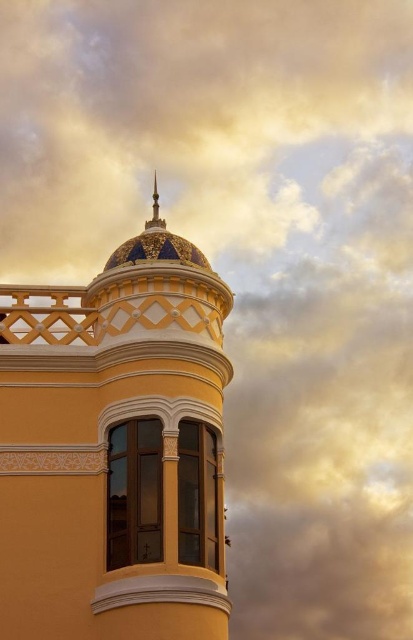
Is point (118, 620) in front of point (165, 227)?

That is True.

Between matte yellow bell tower at center and gold metallic spire at upper center, which one is positioned higher?

gold metallic spire at upper center

Which is in front, point (185, 556) or point (156, 186)?

Positioned in front is point (185, 556).

You are a GUI agent. You are given a task and a screenshot of the screen. Output one action in this format:
    pyautogui.click(x=<x>, y=<y>)
    Task: Click on the matte yellow bell tower at center
    The height and width of the screenshot is (640, 413).
    Given the screenshot: What is the action you would take?
    pyautogui.click(x=114, y=451)